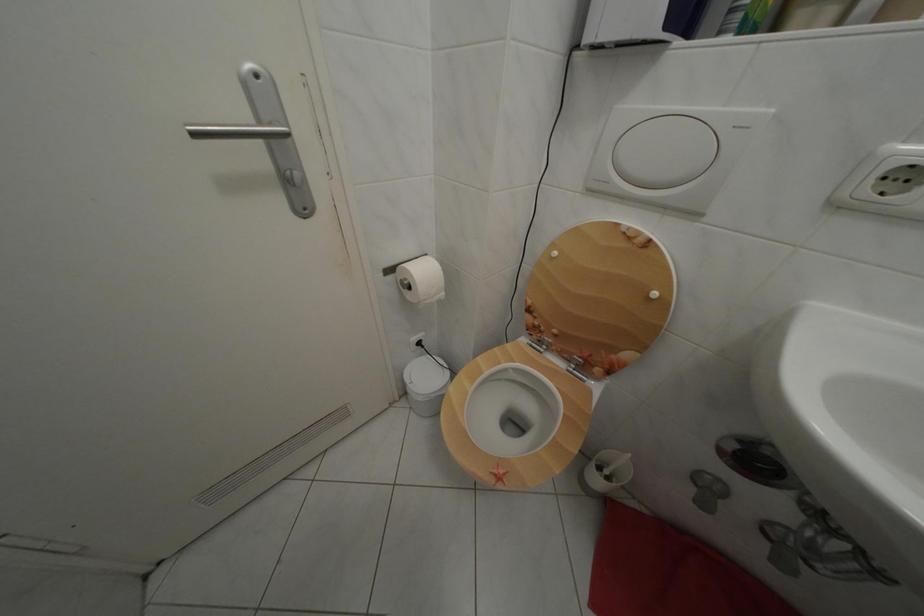
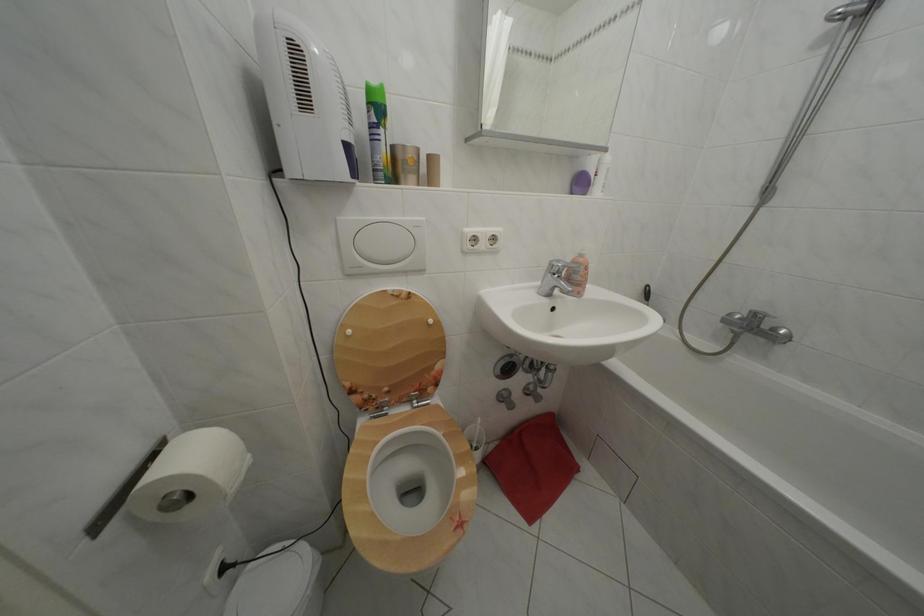
In the second image, find the point that corresponds to (x=578, y=368) in the first image.

(419, 407)